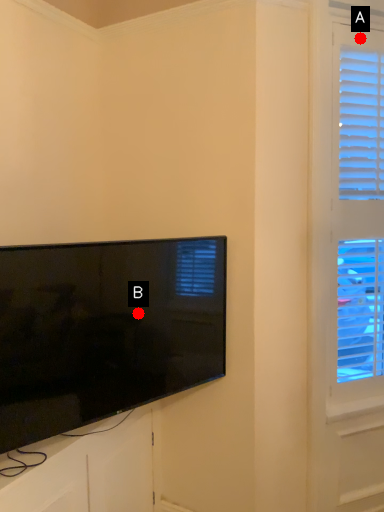
Question: Two points are circled on the image, labeled by A and B beside each circle. Which of the following is the closest to the observer?

Choices:
 (A) A is closer
 (B) B is closer

Answer: (B)